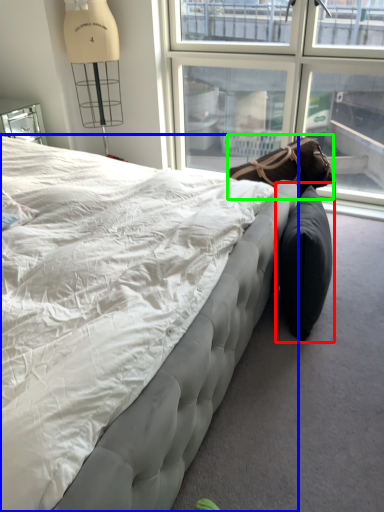
Question: Estimate the real-world distances between objects in this image. Which object is farther from bean bag chair (highlighted by a red box), bed (highlighted by a blue box) or bean bag chair (highlighted by a green box)?

Choices:
 (A) bed
 (B) bean bag chair

Answer: (A)